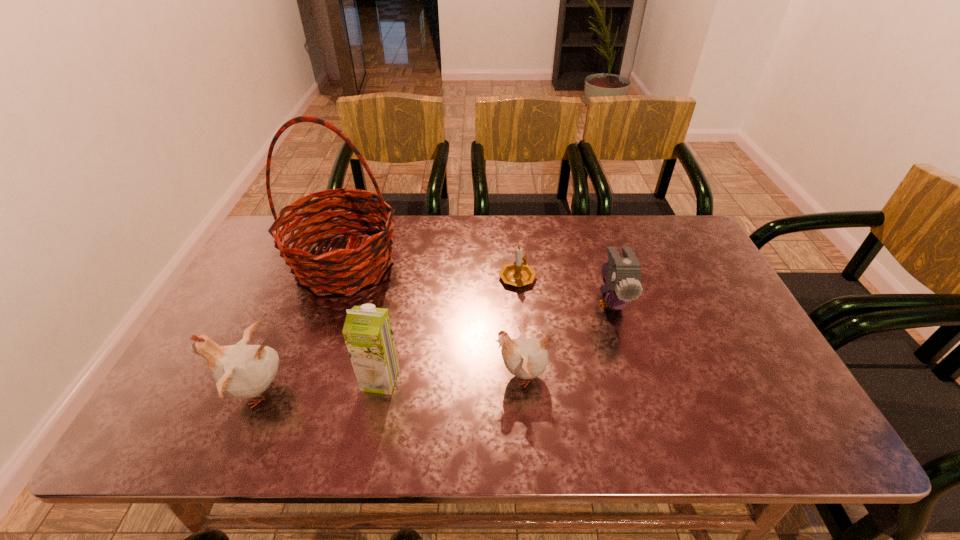
This screenshot has height=540, width=960. Find the location of `the leftmost bird`. the leftmost bird is located at coordinates (244, 371).

Locate an element on the screen. The width and height of the screenshot is (960, 540). the second bird from left to right is located at coordinates (525, 358).

Identify the location of the rightmost object. The width and height of the screenshot is (960, 540). (x=623, y=275).

The width and height of the screenshot is (960, 540). I want to click on the farthest bird, so tap(623, 275).

Where is `basket`? This screenshot has height=540, width=960. basket is located at coordinates (363, 263).

I want to click on candle holder, so click(x=519, y=273).

Where is `the fifth shortest object`? The height and width of the screenshot is (540, 960). the fifth shortest object is located at coordinates (367, 331).

Where is `vacant space positioned 0.070m at the beak of the leftmost bird`? The width and height of the screenshot is (960, 540). vacant space positioned 0.070m at the beak of the leftmost bird is located at coordinates (190, 391).

Locate an element on the screen. free space located 0.060m at the beak of the leftmost bird is located at coordinates (195, 391).

Identify the location of vacant area situated at the beak of the leftmost bird. (181, 391).